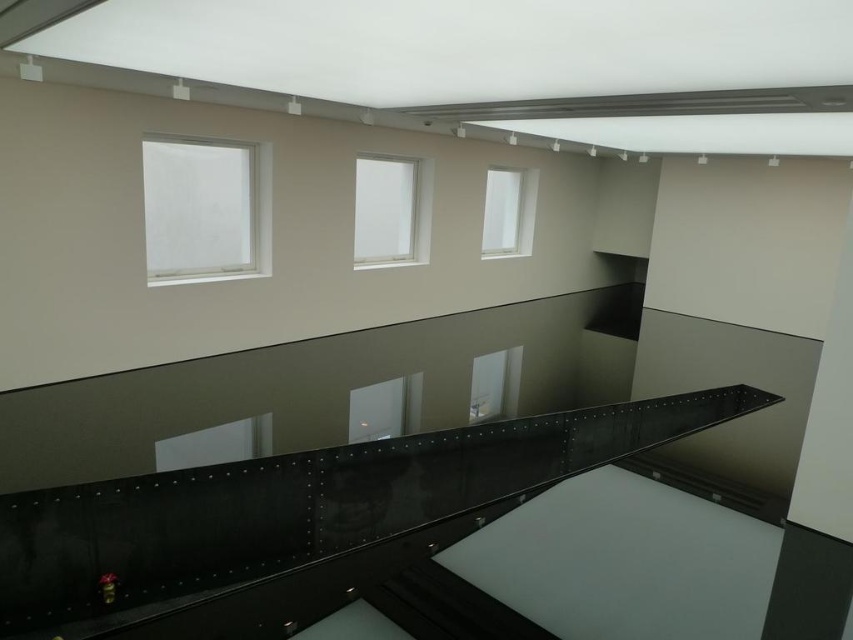
You are a maintenance worker needing to replace a broken part. You see the glossy metal balustrade at center and the clear glass window at center. Which object requires a larger replacement part?

The glossy metal balustrade at center requires a larger replacement part because it is bigger than the clear glass window at center.

Looking at this image, you are a maintenance worker needing to replace the balustrade. You see the glossy metal balustrade at center and the white matte window at upper left. Which object is located to the right of the other?

The glossy metal balustrade at center is positioned on the right side of white matte window at upper left.

You are a maintenance worker needing to access the glossy metal balustrade at center for repairs. The white matte window at upper left is in the way. Can you reach the balustrade without moving the window?

The glossy metal balustrade at center is positioned under the white matte window at upper left, so you can access the balustrade from below the window without needing to move it.